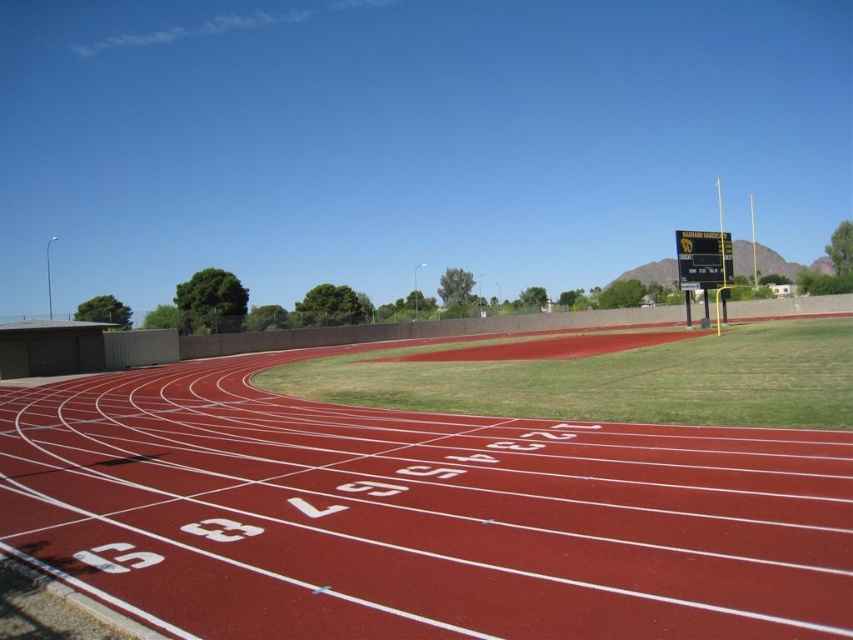
Does rubberized red track at center come behind yellow-green plastic scoreboard at upper right?

No, it is not.

Between point (283, 397) and point (691, 248), which one is positioned behind?

The point (691, 248) is more distant.

Identify the location of rubberized red track at center. (x=419, y=516).

This screenshot has width=853, height=640. I want to click on rubberized red track at center, so click(419, 516).